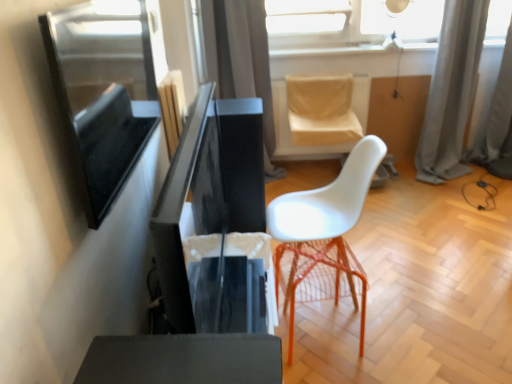
Where is `vacant space to the right of white plastic chair at center`? This screenshot has height=384, width=512. vacant space to the right of white plastic chair at center is located at coordinates (404, 283).